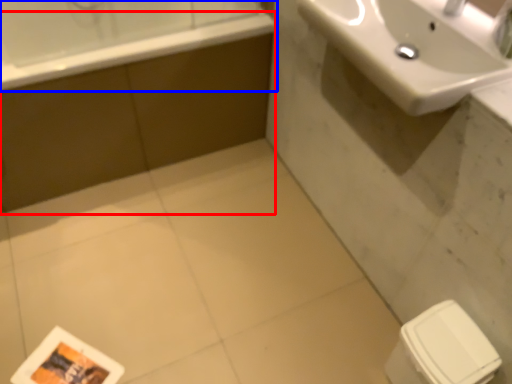
Question: Which point is closer to the camera, bath (highlighted by a red box) or bathtub (highlighted by a blue box)?

Choices:
 (A) bath
 (B) bathtub

Answer: (B)